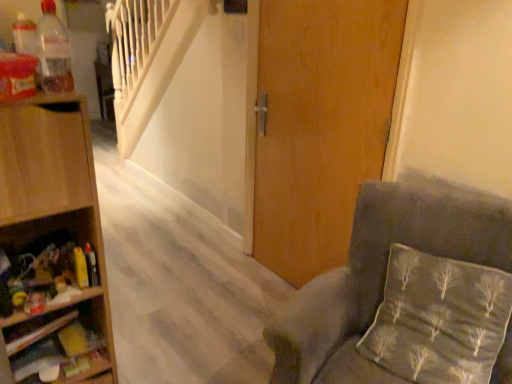
Question: Is velvet grey chair at lower right in contact with wooden shelf at left, positioned as the first shelf in top-to-bottom order?

Choices:
 (A) no
 (B) yes

Answer: (A)

Question: Is velvet grey chair at lower right located outside wooden shelf at left, positioned as the first shelf in top-to-bottom order?

Choices:
 (A) yes
 (B) no

Answer: (A)

Question: From a real-world perspective, is velvet grey chair at lower right physically above wooden shelf at left, the 2th shelf in the bottom-to-top sequence?

Choices:
 (A) yes
 (B) no

Answer: (B)

Question: From the image's perspective, is velvet grey chair at lower right beneath wooden shelf at left, positioned as the first shelf in top-to-bottom order?

Choices:
 (A) no
 (B) yes

Answer: (B)

Question: Is velvet grey chair at lower right not close to wooden shelf at left, positioned as the first shelf in top-to-bottom order?

Choices:
 (A) no
 (B) yes

Answer: (A)

Question: From the image's perspective, relative to silky gray pillow at lower right, is wooden shelves at lower left, which is counted as the 2th shelf, starting from the top, above or below?

Choices:
 (A) above
 (B) below

Answer: (B)

Question: Is wooden shelves at lower left, which is counted as the 2th shelf, starting from the top, taller or shorter than silky gray pillow at lower right?

Choices:
 (A) short
 (B) tall

Answer: (A)

Question: From a real-world perspective, is wooden shelves at lower left, which is counted as the 2th shelf, starting from the top, above or below silky gray pillow at lower right?

Choices:
 (A) above
 (B) below

Answer: (B)

Question: Is wooden shelves at lower left, the 1th shelf from the bottom, spatially inside silky gray pillow at lower right, or outside of it?

Choices:
 (A) outside
 (B) inside

Answer: (A)

Question: Considering the positions of wooden shelf at left, positioned as the first shelf in top-to-bottom order, and wooden door at center in the image, is wooden shelf at left, positioned as the first shelf in top-to-bottom order, bigger or smaller than wooden door at center?

Choices:
 (A) small
 (B) big

Answer: (A)

Question: Is wooden shelf at left, the 2th shelf in the bottom-to-top sequence, situated inside wooden door at center or outside?

Choices:
 (A) outside
 (B) inside

Answer: (A)

Question: From a real-world perspective, is wooden shelf at left, the 2th shelf in the bottom-to-top sequence, physically located above or below wooden door at center?

Choices:
 (A) below
 (B) above

Answer: (A)

Question: Based on their positions, is wooden shelf at left, the 2th shelf in the bottom-to-top sequence, located to the left or right of wooden door at center?

Choices:
 (A) left
 (B) right

Answer: (A)

Question: Considering the positions of wooden shelf at left, the 2th shelf in the bottom-to-top sequence, and velvet grey chair at lower right in the image, is wooden shelf at left, the 2th shelf in the bottom-to-top sequence, wider or thinner than velvet grey chair at lower right?

Choices:
 (A) thin
 (B) wide

Answer: (A)

Question: From a real-world perspective, is wooden shelf at left, positioned as the first shelf in top-to-bottom order, physically located above or below velvet grey chair at lower right?

Choices:
 (A) above
 (B) below

Answer: (A)